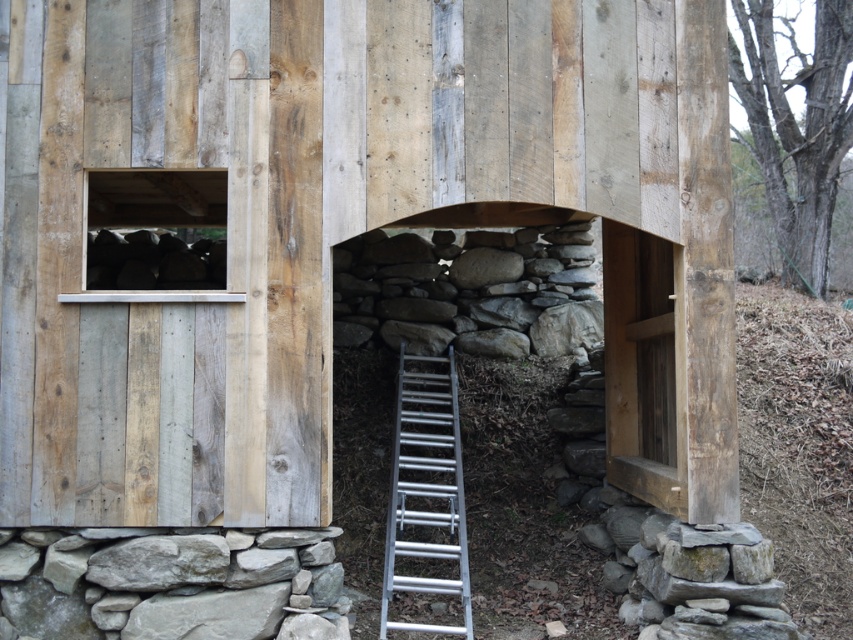
You are a painter who needs to reach the top of the weathered wood barn at center to touch up the paint. You have a silver metallic ladder at center. Based on the scene description, will the ladder be tall enough to reach the top of the barn?

The weathered wood barn at center is much taller than the silver metallic ladder at center, so the ladder will not be tall enough to reach the top of the barn.

You are standing in front of the weathered wood barn at center and the silver metallic ladder at center. Which object is closer to you?

The weathered wood barn at center is closer to you because it is in front of the silver metallic ladder at center.

You are standing in front of the rustic wooden structure and want to touch both the point at coordinates point (45, 506) and the point at coordinates point (412, 380). Which point will you reach first?

You will reach the point at coordinates point (45, 506) first because it is closer to you than the point at coordinates point (412, 380).